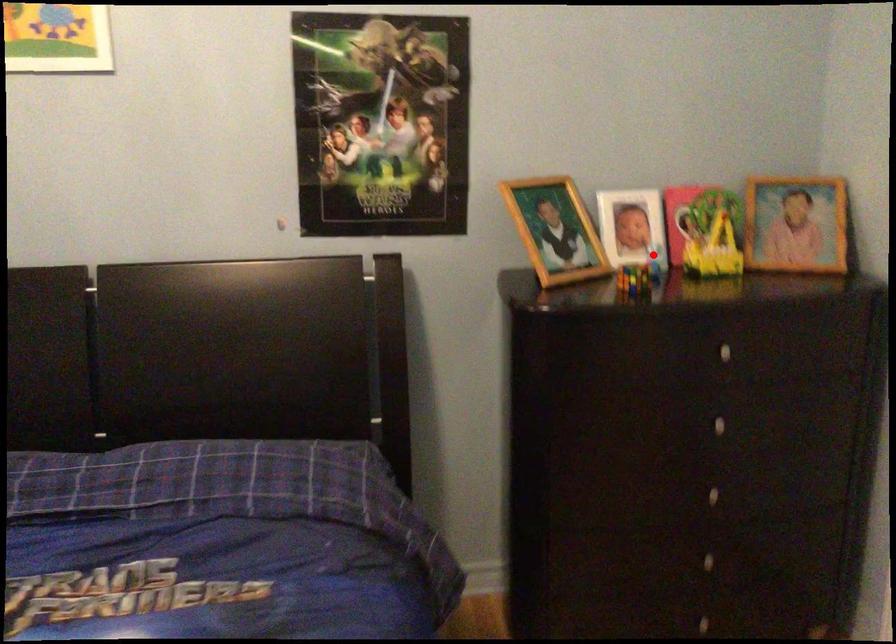
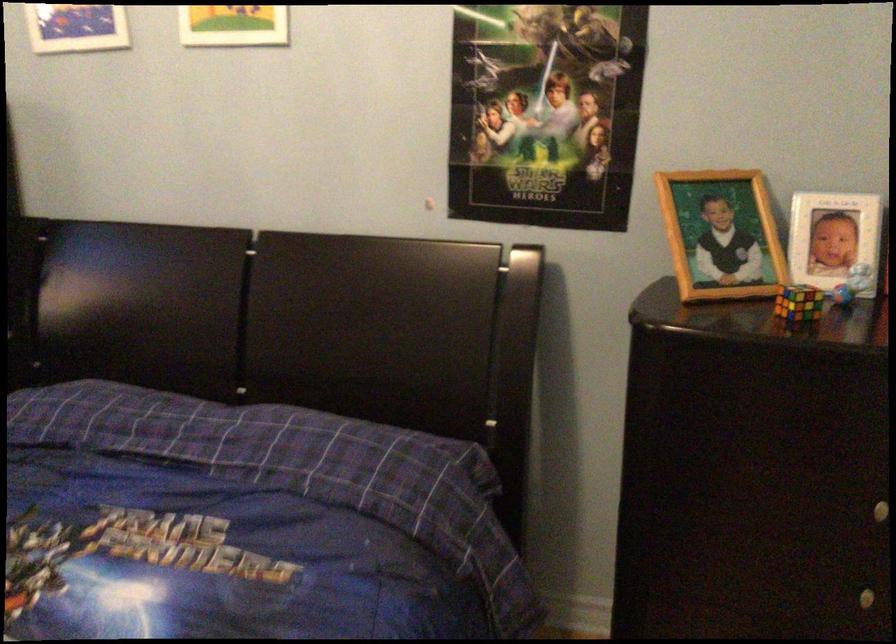
Where in the second image is the point corresponding to the highlighted location from the first image?

(851, 283)